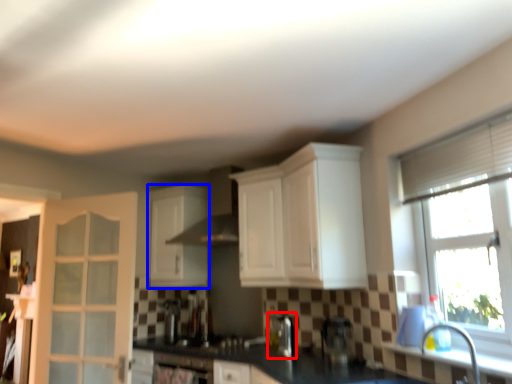
Question: Which point is closer to the camera, coffee machine (highlighted by a red box) or cabinetry (highlighted by a blue box)?

Choices:
 (A) coffee machine
 (B) cabinetry

Answer: (A)